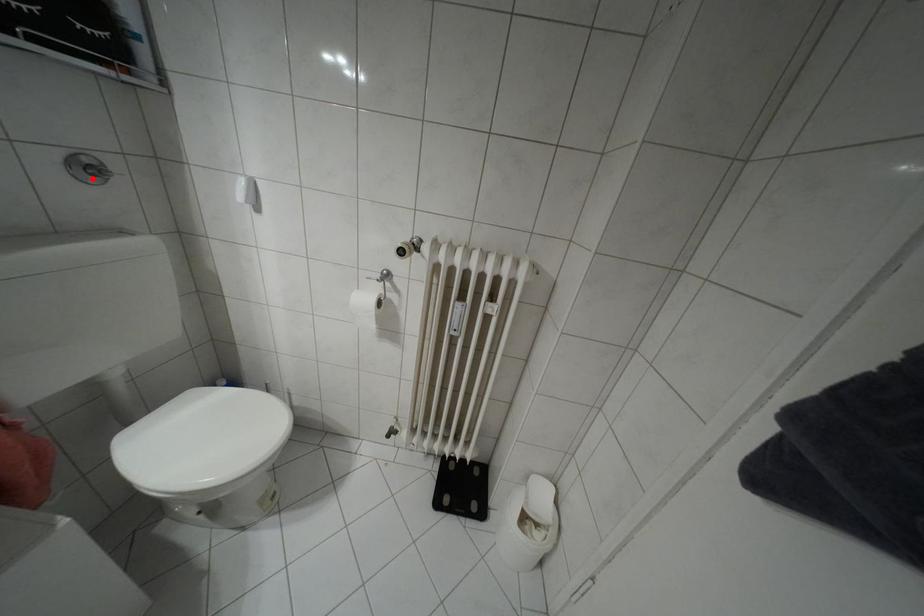
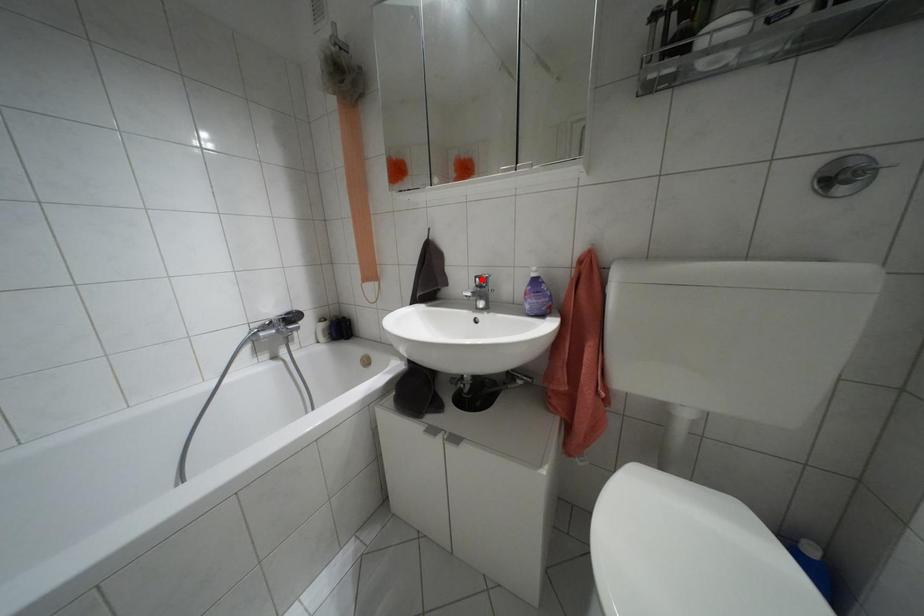
I am providing you with two images of the same scene from different viewpoints. A red point is marked on the first image and another point is marked on the second image. Is the red point in image1 aligned with the point shown in image2?

No